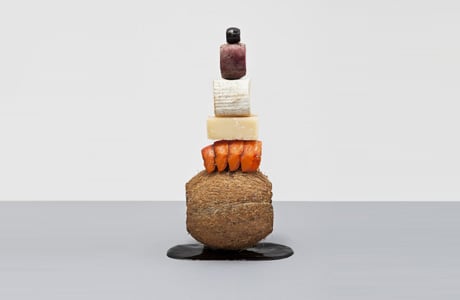
I want to click on black stand, so click(214, 254).